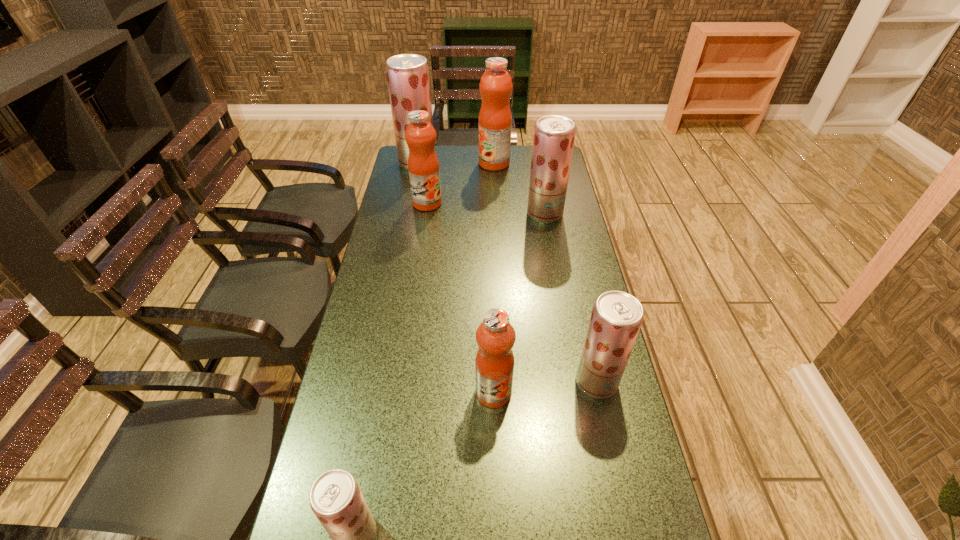
Identify the location of the farthest orange fruit juice. This screenshot has width=960, height=540. (495, 119).

Locate an element on the screen. the biggest strawberry fruit juice is located at coordinates (408, 79).

The height and width of the screenshot is (540, 960). Identify the location of the third nearest strawberry fruit juice. (554, 135).

Where is `the leftmost orange fruit juice`? Image resolution: width=960 pixels, height=540 pixels. the leftmost orange fruit juice is located at coordinates (423, 165).

The image size is (960, 540). Find the location of `the second farthest orange fruit juice`. the second farthest orange fruit juice is located at coordinates (423, 165).

Image resolution: width=960 pixels, height=540 pixels. I want to click on the third farthest strawberry fruit juice, so click(616, 318).

Image resolution: width=960 pixels, height=540 pixels. What are the coordinates of `the nearest orange fruit juice` in the screenshot? It's located at (495, 336).

At what (x,y) coordinates should I click in order to perform the action: click on free space located on the front label of the biggest orange fruit juice. Please return your answer as a coordinate pair (x, y). This screenshot has height=540, width=960. Looking at the image, I should click on (397, 164).

Where is `vacant region located on the front label of the biggest orange fruit juice`? The width and height of the screenshot is (960, 540). vacant region located on the front label of the biggest orange fruit juice is located at coordinates (461, 164).

This screenshot has width=960, height=540. I want to click on free space located on the front label of the biggest orange fruit juice, so click(x=445, y=164).